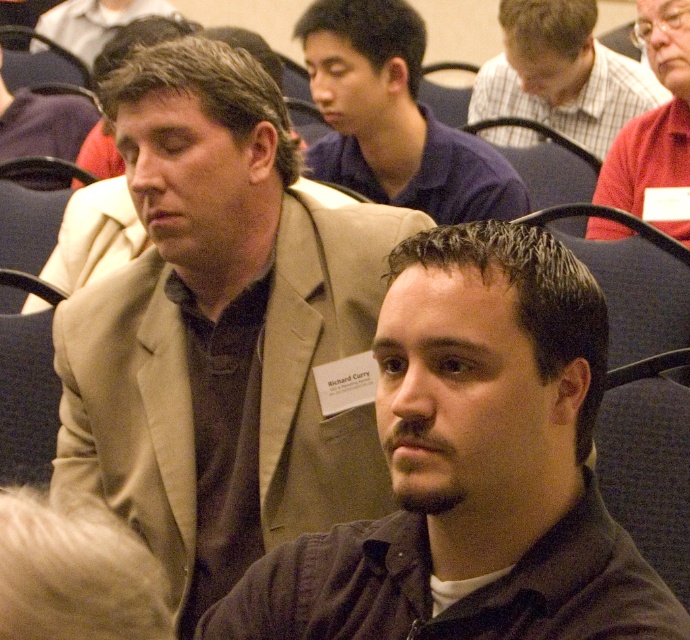
Who is shorter, beige suit jacket at center or matte black suit at upper left?

Standing shorter between the two is matte black suit at upper left.

Is beige suit jacket at center bigger than matte black suit at upper left?

Yes, beige suit jacket at center is bigger than matte black suit at upper left.

Does point (97, 342) come farther from viewer compared to point (17, 112)?

No, (97, 342) is closer to viewer.

The width and height of the screenshot is (690, 640). Find the location of `beige suit jacket at center`. beige suit jacket at center is located at coordinates (221, 330).

Can you confirm if dark blue shirt at center is positioned above matte brown suit at center?

Incorrect, dark blue shirt at center is not positioned above matte brown suit at center.

What do you see at coordinates (394, 116) in the screenshot? I see `dark blue shirt at center` at bounding box center [394, 116].

What are the coordinates of `dark blue shirt at center` in the screenshot? It's located at (394, 116).

At what (x,y) coordinates should I click in order to perform the action: click on dark blue shirt at center. Please return your answer as a coordinate pair (x, y). This screenshot has width=690, height=640. Looking at the image, I should click on [394, 116].

Does point (535, 100) come closer to viewer compared to point (55, 97)?

No, (535, 100) is behind (55, 97).

Which is below, plaid shirt at upper center or matte black suit at upper left?

Positioned lower is matte black suit at upper left.

Find the location of a particular element. Image resolution: width=690 pixels, height=640 pixels. plaid shirt at upper center is located at coordinates (561, 74).

This screenshot has width=690, height=640. I want to click on plaid shirt at upper center, so click(x=561, y=74).